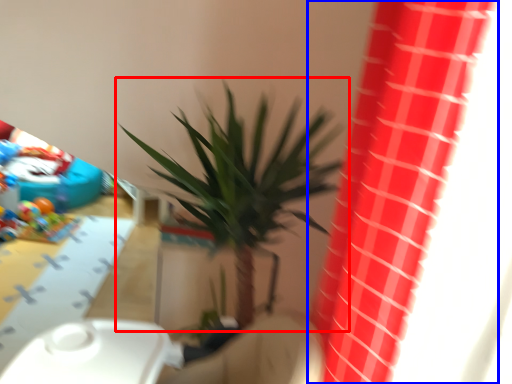
Question: Which object appears farthest to the camera in this image, houseplant (highlighted by a red box) or curtain (highlighted by a blue box)?

Choices:
 (A) houseplant
 (B) curtain

Answer: (A)